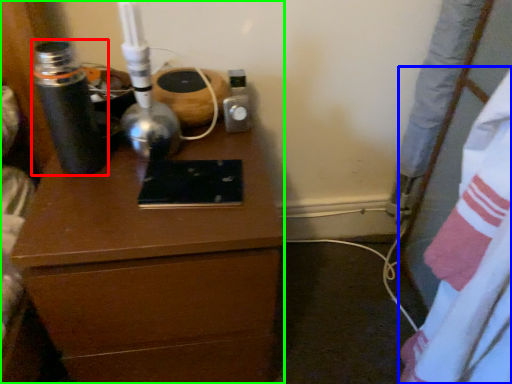
Question: Estimate the real-world distances between objects in this image. Which object is closer to bottle (highlighted by a red box), sheet (highlighted by a blue box) or chest of drawers (highlighted by a green box)?

Choices:
 (A) sheet
 (B) chest of drawers

Answer: (B)